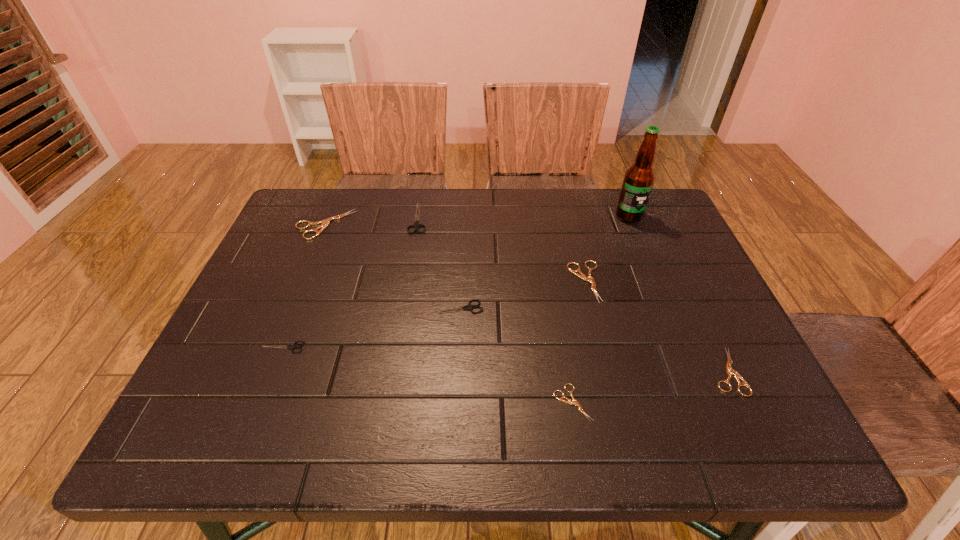
Locate which shears is the fourth closest to the third nearest beige shears. Please provide its 2D coordinates. Your answer should be formatted as a tuple, i.e. [(x, y)], where the tuple contains the x and y coordinates of a point satisfying the conditions above.

[(416, 225)]

Choose which black shears is the third nearest neighbor to the leftmost beige shears. Please provide its 2D coordinates. Your answer should be formatted as a tuple, i.e. [(x, y)], where the tuple contains the x and y coordinates of a point satisfying the conditions above.

[(293, 346)]

In order to click on black shears identified as the second closest to the third nearest beige shears in this screenshot , I will do `click(416, 225)`.

Select which beige shears appears as the fourth closest to the fifth shears from right to left. Please provide its 2D coordinates. Your answer should be formatted as a tuple, i.e. [(x, y)], where the tuple contains the x and y coordinates of a point satisfying the conditions above.

[(730, 371)]

Locate an element on the screen. beige shears that is the third closest to the fifth shears from right to left is located at coordinates (574, 402).

Locate an element on the screen. free space that satisfies the following two spatial constraints: 1. on the front side of the second beige shears from left to right; 2. on the right side of the farthest beige shears is located at coordinates (252, 403).

I want to click on free spot that satisfies the following two spatial constraints: 1. on the front side of the third nearest beige shears; 2. on the left side of the farthest beige shears, so click(301, 282).

At what (x,y) coordinates should I click in order to perform the action: click on vacant region that satisfies the following two spatial constraints: 1. on the front side of the leftmost black shears; 2. on the right side of the rightmost beige shears. Please return your answer as a coordinate pair (x, y). The width and height of the screenshot is (960, 540). Looking at the image, I should click on (x=273, y=371).

The image size is (960, 540). What are the coordinates of `blank area in the image that satisfies the following two spatial constraints: 1. on the front side of the second smallest beige shears; 2. on the left side of the leftmost beige shears` in the screenshot? It's located at (265, 371).

Where is `free space that satisfies the following two spatial constraints: 1. on the back side of the smallest black shears; 2. on the left side of the biggest black shears`? The height and width of the screenshot is (540, 960). free space that satisfies the following two spatial constraints: 1. on the back side of the smallest black shears; 2. on the left side of the biggest black shears is located at coordinates (334, 218).